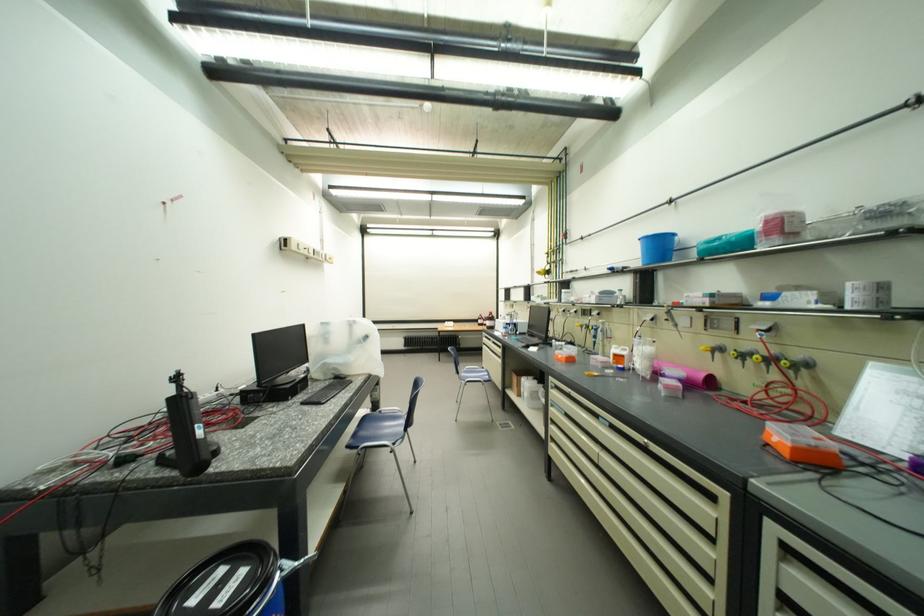
Which object does [801,445] point to?

This point indicates the orange plastic box.